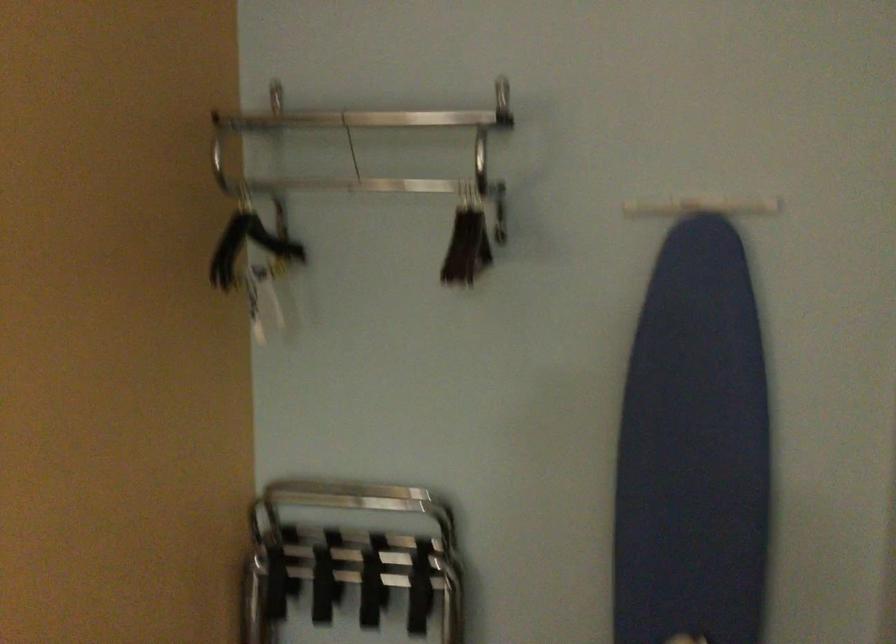
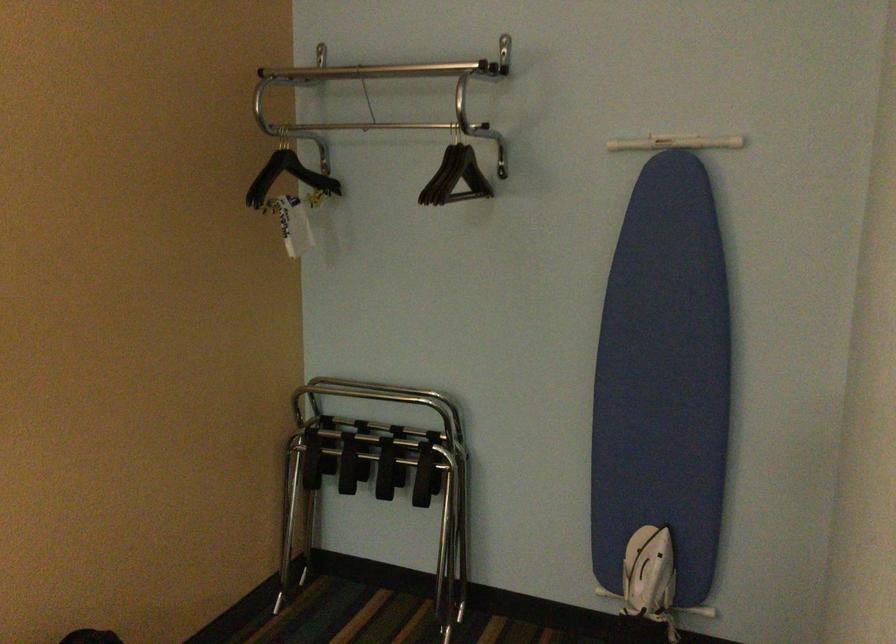
Where in the second image is the point corresponding to (263,301) from the first image?

(291, 223)